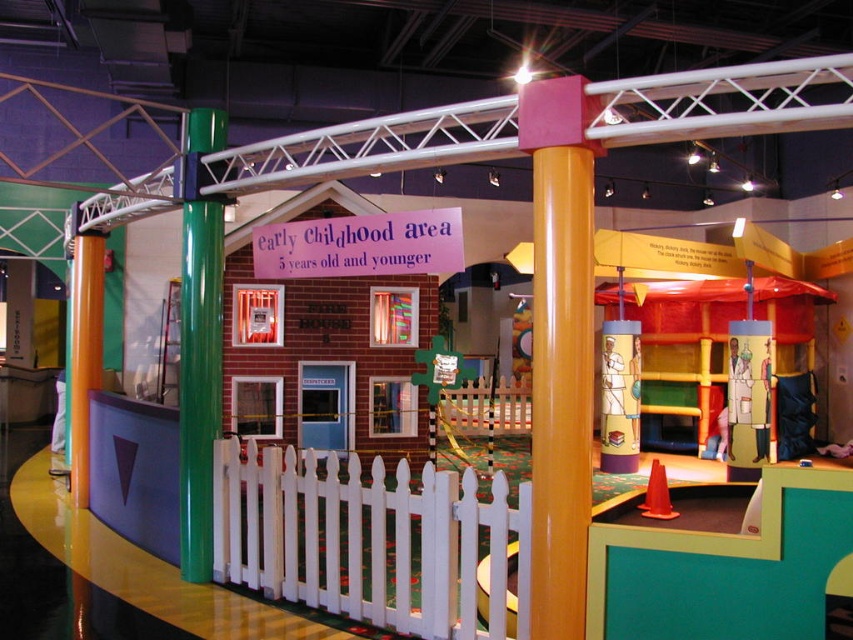
Question: Considering the relative positions of orange glossy column at center and rubber cone at center in the image provided, where is orange glossy column at center located with respect to rubber cone at center?

Choices:
 (A) above
 (B) below

Answer: (A)

Question: Estimate the real-world distances between objects in this image. Which object is closer to the rubber cone at center?

Choices:
 (A) orange matte column at left
 (B) green glossy pillar at left

Answer: (B)

Question: Considering the real-world distances, which object is closest to the orange matte column at left?

Choices:
 (A) orange glossy column at center
 (B) green glossy pillar at left

Answer: (B)

Question: Does orange glossy column at center have a smaller size compared to orange matte column at left?

Choices:
 (A) no
 (B) yes

Answer: (B)

Question: Is the position of orange glossy column at center less distant than that of rubber cone at center?

Choices:
 (A) yes
 (B) no

Answer: (A)

Question: Which point is closer to the camera?

Choices:
 (A) [660, 483]
 (B) [86, 452]
 (C) [566, 204]
 (D) [189, 468]

Answer: (C)